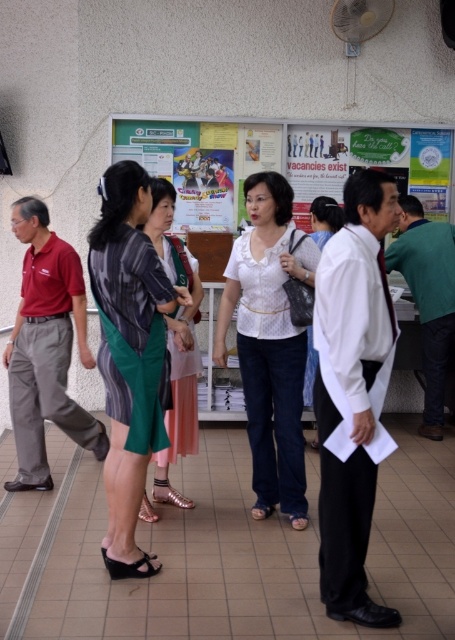
You are standing in the room and want to hand a document to the person wearing the matte striped shirt at center and the white textured blouse at center. Which one can you reach first without moving closer?

The matte striped shirt at center is closer to the viewer than the white textured blouse at center, so you can reach the person wearing the matte striped shirt at center first without moving closer.

You are standing in the center of the room and see a point at coordinates (176, 342). What object is located at that point?

The point at coordinates (176, 342) corresponds to the matte striped shirt at center.

What is the position of the point labeled at coordinates [269,342] in the image?

The point labeled at coordinates [269,342] is located on the white lace blouse at center.